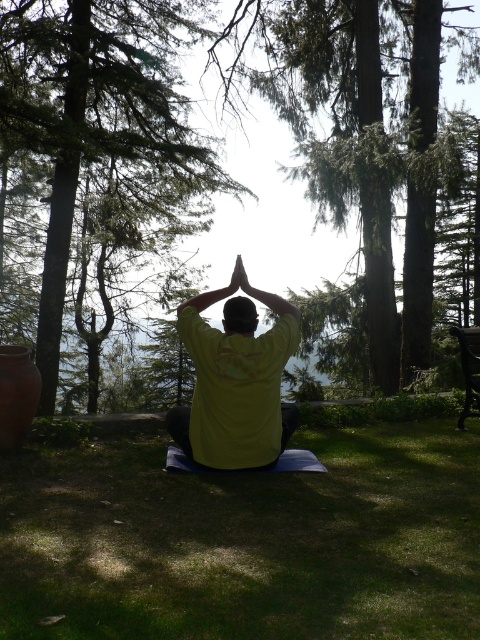
You are a photographer trying to capture the yoga practitioner from above. Which object, the green grass at center or the green leafy tree at center, would be in the foreground of your photo?

The green grass at center is below the green leafy tree at center, so the green leafy tree at center would be closer to the camera and thus in the foreground.